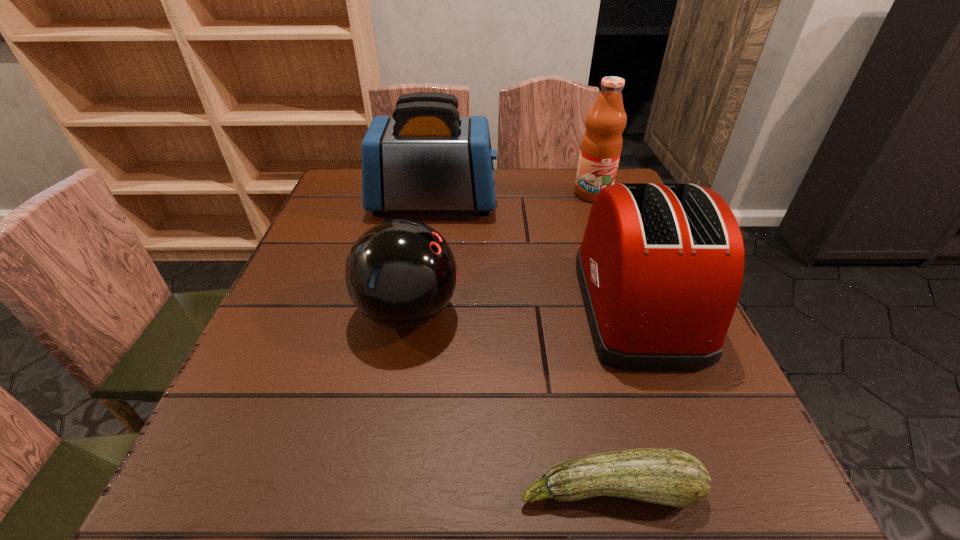
Find the location of a particular element. vacant space at the near edge of the desktop is located at coordinates (468, 483).

The width and height of the screenshot is (960, 540). Identify the location of vacant space at the left edge. (x=334, y=236).

In the image, there is a desktop. Where is `free space at the right edge`? free space at the right edge is located at coordinates (714, 423).

In the image, there is a desktop. Identify the location of free space at the far left corner. (329, 194).

Where is `vacant space at the near left corner of the desktop`? The image size is (960, 540). vacant space at the near left corner of the desktop is located at coordinates (210, 492).

At what (x,y) coordinates should I click in order to perform the action: click on vacant space at the far right corner. Please return your answer as a coordinate pair (x, y). This screenshot has width=960, height=540. Looking at the image, I should click on (567, 178).

In the image, there is a desktop. At what (x,y) coordinates should I click in order to perform the action: click on vacant space at the near right corner. Please return your answer as a coordinate pair (x, y). This screenshot has width=960, height=540. Looking at the image, I should click on (781, 496).

You are a GUI agent. You are given a task and a screenshot of the screen. Output one action in this format:
    pyautogui.click(x=<x>, y=<y>)
    Task: Click on the free space between the right toaster and the left toaster
    The height and width of the screenshot is (540, 960).
    Given the screenshot: What is the action you would take?
    coord(535,253)

You are a GUI agent. You are given a task and a screenshot of the screen. Output one action in this format:
    pyautogui.click(x=<x>, y=<y>)
    Task: Click on the free spot between the nearer toaster and the farther toaster
    The height and width of the screenshot is (540, 960).
    Given the screenshot: What is the action you would take?
    pyautogui.click(x=535, y=253)

This screenshot has width=960, height=540. What are the coordinates of `free spot between the second shortest object and the zucchini` in the screenshot? It's located at (509, 401).